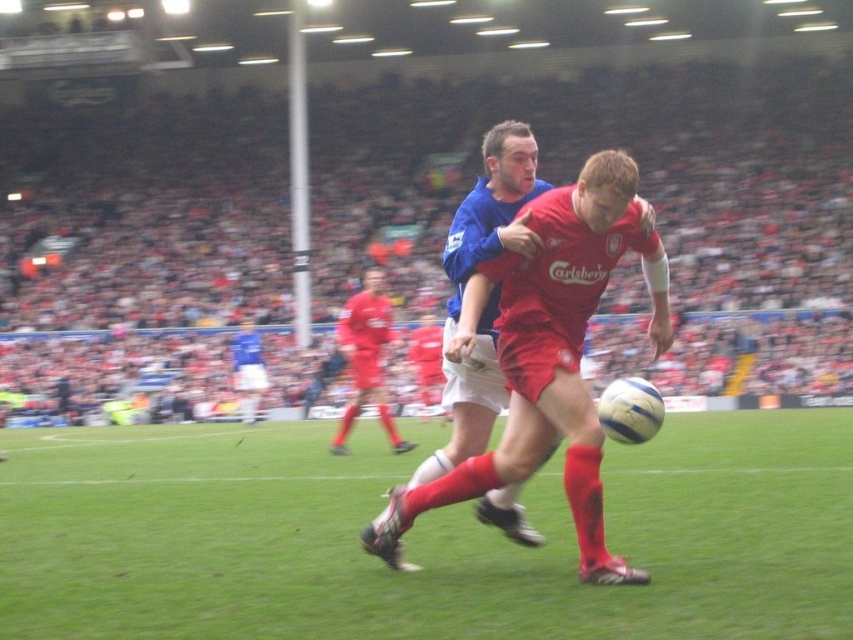
You are a soccer referee positioned at the edge of the field. You need to quickly assess if the blue jersey at center is within a 3 meters distance from the green grass at center to make a foul call. Based on the scene, what is your decision?

The distance between the green grass at center and the blue jersey at center is 3.19 meters, which is slightly over the 3 meters threshold. Therefore, the blue jersey at center is just outside the required distance for a foul call.

Based on the coordinates provided, where is the blue jersey at center located in the image?

The blue jersey at center is located at coordinates point (492, 211).

You are a soccer coach observing the match. You notice the matte red soccer player at center is trying to pass the ball forward. Based on the scene, can the player pass the ball through the green grass at center without obstruction?

The green grass at center is in front of the matte red soccer player at center, so the player can pass the ball through the green grass at center without obstruction since there is no object blocking the path.